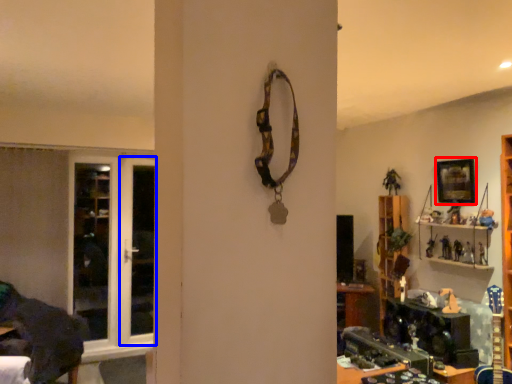
Question: Which of the following is the closest to the observer, picture frame (highlighted by a red box) or screen door (highlighted by a blue box)?

Choices:
 (A) picture frame
 (B) screen door

Answer: (A)